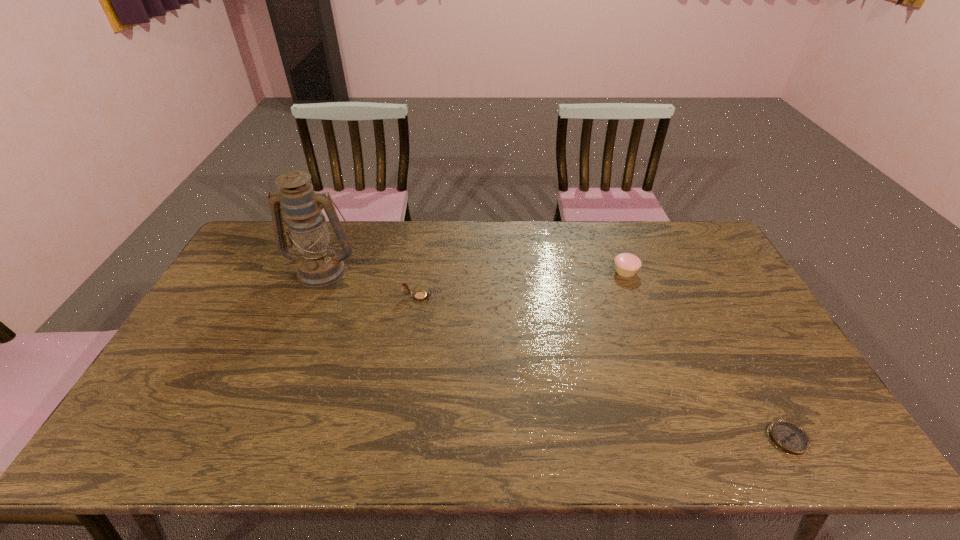
You are a GUI agent. You are given a task and a screenshot of the screen. Output one action in this format:
    pyautogui.click(x=<x>, y=<y>)
    Task: Click on the blank space located on the left of the nearer compass
    The height and width of the screenshot is (540, 960).
    Given the screenshot: What is the action you would take?
    pyautogui.click(x=722, y=439)

Find the location of a particular element. object positioned at the far edge is located at coordinates (319, 265).

Locate an element on the screen. This screenshot has width=960, height=540. object that is at the near edge is located at coordinates (788, 437).

Locate an element on the screen. Image resolution: width=960 pixels, height=540 pixels. object at the right edge is located at coordinates (788, 437).

Find the location of a particular element. object at the near right corner is located at coordinates (788, 437).

Where is `blank area at the far edge`? This screenshot has width=960, height=540. blank area at the far edge is located at coordinates (557, 249).

The height and width of the screenshot is (540, 960). Find the location of `vacant space at the near edge`. vacant space at the near edge is located at coordinates (511, 429).

Identify the location of free region at the left edge of the desktop. The image size is (960, 540). (222, 326).

Image resolution: width=960 pixels, height=540 pixels. In the image, there is a desktop. What are the coordinates of `vacant space at the far right corner` in the screenshot? It's located at pyautogui.click(x=684, y=239).

Find the location of a particular element. The width and height of the screenshot is (960, 540). vacant area that lies between the leftmost object and the third object from left to right is located at coordinates (474, 271).